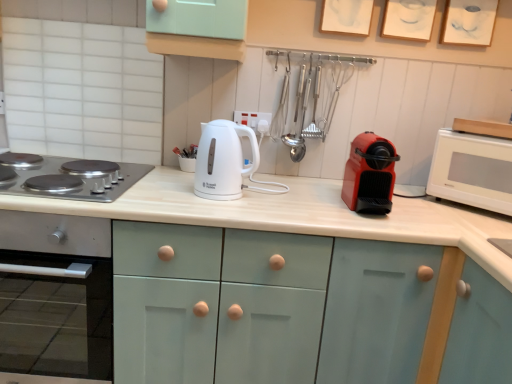
Question: Considering the relative sizes of white matte countertop at center and stainless steel gas stove at left in the image provided, is white matte countertop at center shorter than stainless steel gas stove at left?

Choices:
 (A) yes
 (B) no

Answer: (B)

Question: From the image's perspective, is white matte countertop at center over stainless steel gas stove at left?

Choices:
 (A) yes
 (B) no

Answer: (B)

Question: Considering the relative sizes of white matte countertop at center and stainless steel gas stove at left in the image provided, is white matte countertop at center thinner than stainless steel gas stove at left?

Choices:
 (A) yes
 (B) no

Answer: (B)

Question: From a real-world perspective, is white matte countertop at center located beneath stainless steel gas stove at left?

Choices:
 (A) yes
 (B) no

Answer: (A)

Question: Can you confirm if white matte countertop at center is positioned to the right of stainless steel gas stove at left?

Choices:
 (A) yes
 (B) no

Answer: (A)

Question: Based on their positions, is stainless steel gas stove at left located to the left or right of red matte coffee machine at right, the 1th kitchen appliance from the right?

Choices:
 (A) left
 (B) right

Answer: (A)

Question: In terms of height, does stainless steel gas stove at left look taller or shorter compared to red matte coffee machine at right, the 1th kitchen appliance from the right?

Choices:
 (A) short
 (B) tall

Answer: (A)

Question: In the image, is stainless steel gas stove at left positioned in front of or behind red matte coffee machine at right, the 1th kitchen appliance from the right?

Choices:
 (A) front
 (B) behind

Answer: (B)

Question: Would you say stainless steel gas stove at left is inside or outside red matte coffee machine at right, the 1th kitchen appliance from the right?

Choices:
 (A) inside
 (B) outside

Answer: (B)

Question: Is point (245, 200) closer or farther from the camera than point (501, 198)?

Choices:
 (A) closer
 (B) farther

Answer: (B)

Question: Relative to white glossy microwave at right, is white matte countertop at center in front or behind?

Choices:
 (A) behind
 (B) front

Answer: (B)

Question: From a real-world perspective, relative to white glossy microwave at right, is white matte countertop at center vertically above or below?

Choices:
 (A) above
 (B) below

Answer: (B)

Question: Is white matte countertop at center taller or shorter than white glossy microwave at right?

Choices:
 (A) tall
 (B) short

Answer: (A)

Question: In terms of height, does red matte coffee machine at right, which is the 2th kitchen appliance from left to right, look taller or shorter compared to white glossy electric kettle at center, acting as the 1th kitchen appliance starting from the left?

Choices:
 (A) short
 (B) tall

Answer: (A)

Question: Relative to white glossy electric kettle at center, acting as the 1th kitchen appliance starting from the left, is red matte coffee machine at right, the 1th kitchen appliance from the right, in front or behind?

Choices:
 (A) behind
 (B) front

Answer: (B)